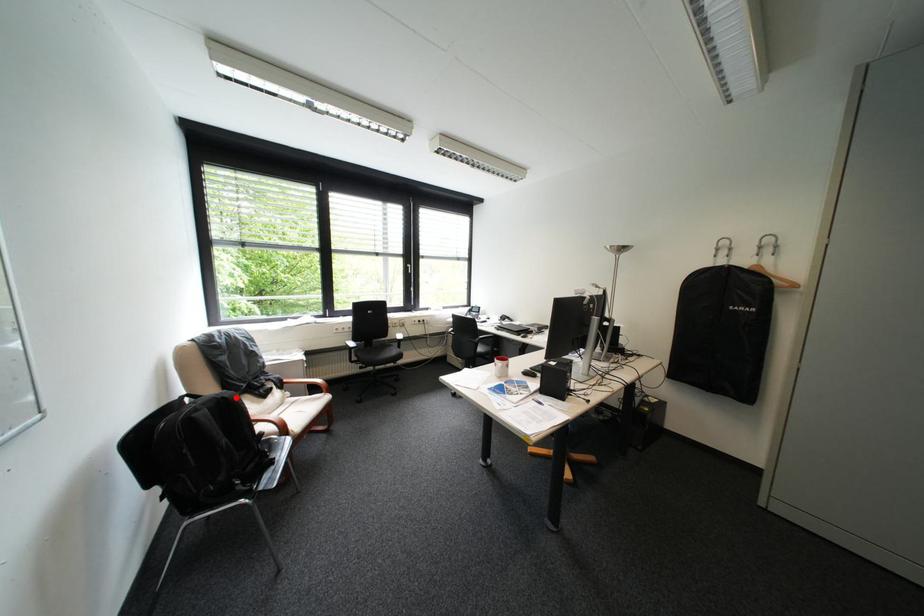
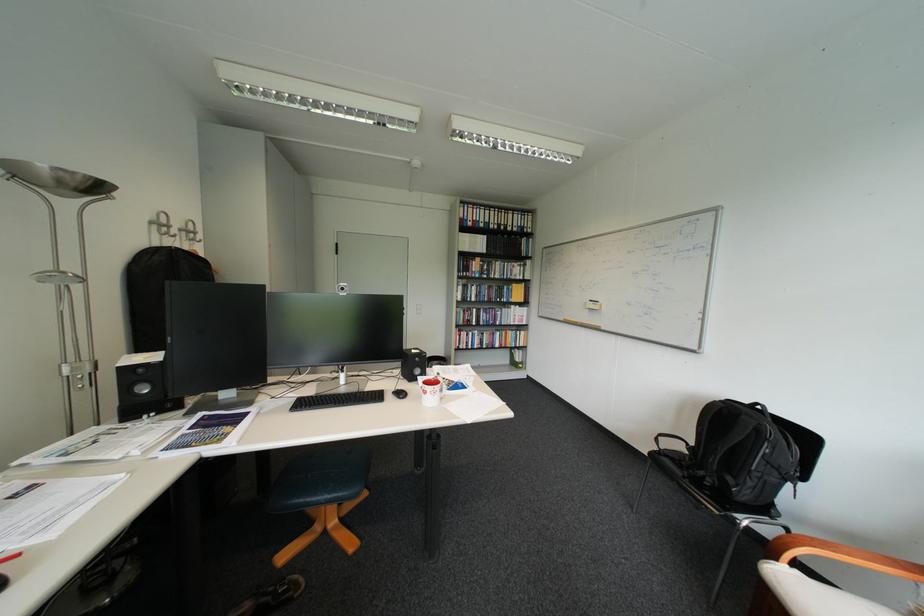
Question: I am providing you with two images of the same scene from different viewpoints. In image1, a red point is highlighted. Considering the same 3D point in image2, which of the following is correct?

Choices:
 (A) It is closer
 (B) It is farther

Answer: (B)